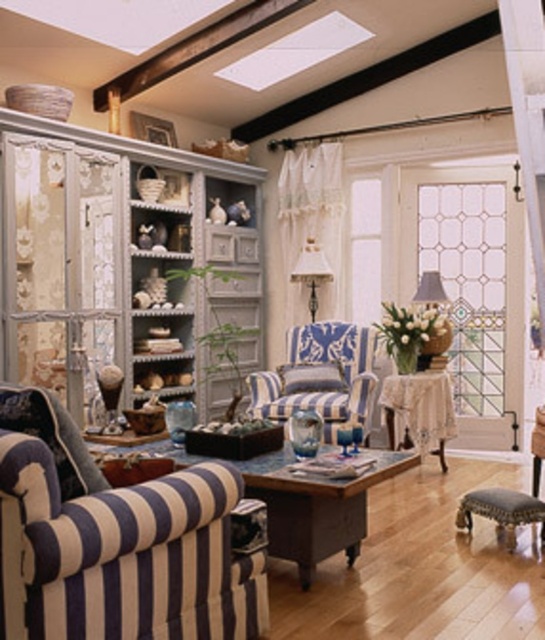
Question: Which object appears farthest from the camera in this image?

Choices:
 (A) dark brown leather stool at lower right
 (B) blue striped fabric couch at lower left
 (C) blue striped armchair at center

Answer: (C)

Question: Among these points, which one is farthest from the camera?

Choices:
 (A) (5, 557)
 (B) (493, 499)

Answer: (B)

Question: Can you confirm if blue striped fabric couch at lower left is positioned to the right of dark brown leather stool at lower right?

Choices:
 (A) no
 (B) yes

Answer: (A)

Question: Considering the relative positions of blue striped fabric couch at lower left and blue striped armchair at center in the image provided, where is blue striped fabric couch at lower left located with respect to blue striped armchair at center?

Choices:
 (A) above
 (B) below

Answer: (B)

Question: Does blue striped armchair at center appear over dark brown leather stool at lower right?

Choices:
 (A) no
 (B) yes

Answer: (B)

Question: Considering the real-world distances, which object is farthest from the blue striped fabric couch at lower left?

Choices:
 (A) dark brown leather stool at lower right
 (B) blue striped armchair at center

Answer: (B)